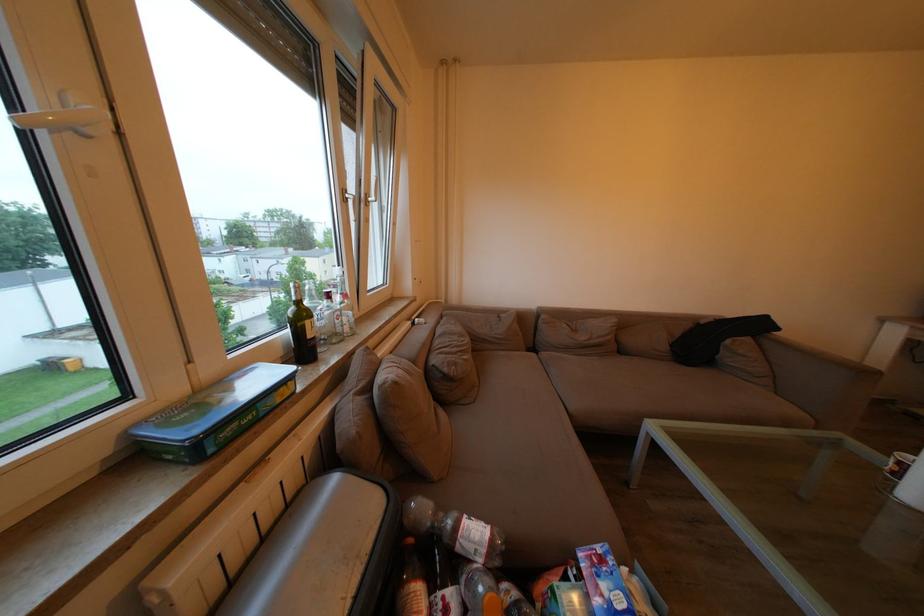
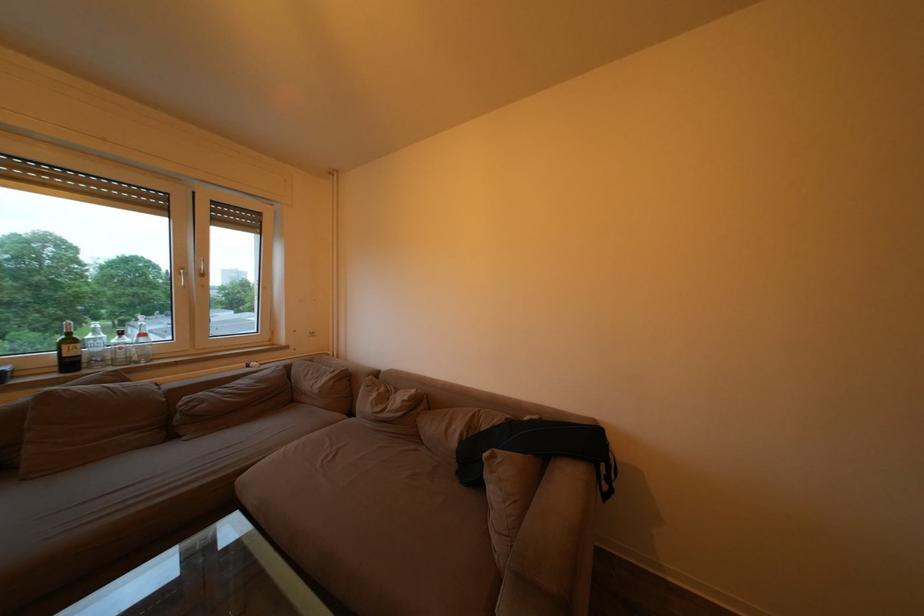
Find the pixel in the second image that matches (296,338) in the first image.

(76, 358)